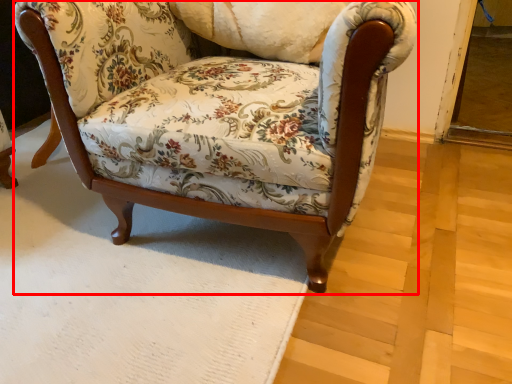
Question: From the image's perspective, what is the correct spatial positioning of chair (annotated by the red box) in reference to pillow?

Choices:
 (A) below
 (B) above

Answer: (A)